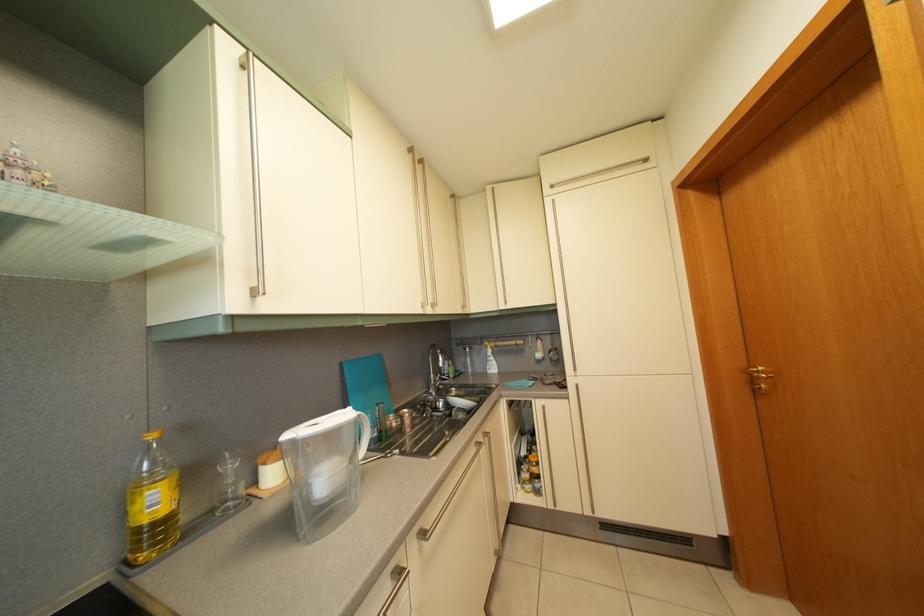
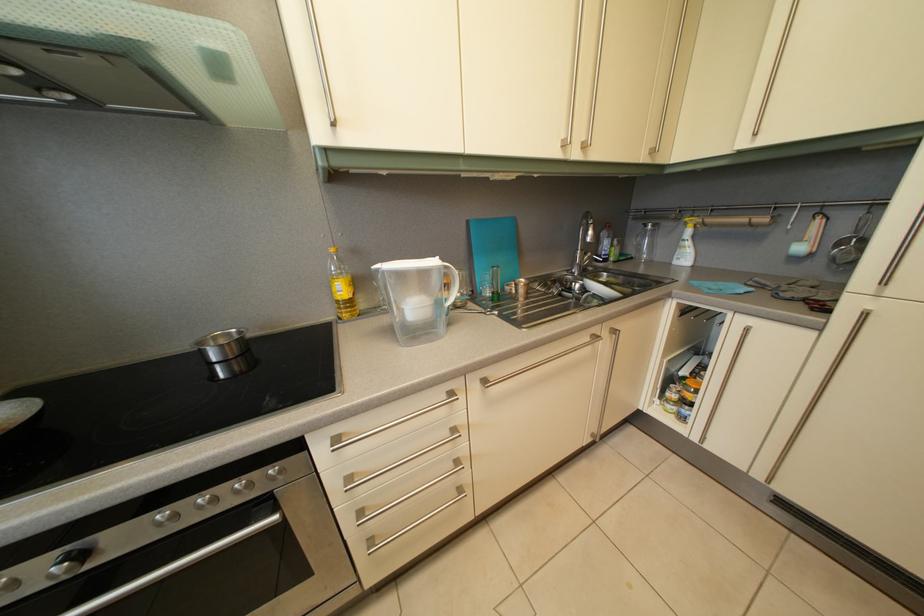
The point at [164,509] is marked in the first image. Where is the corresponding point in the second image?

(349, 297)